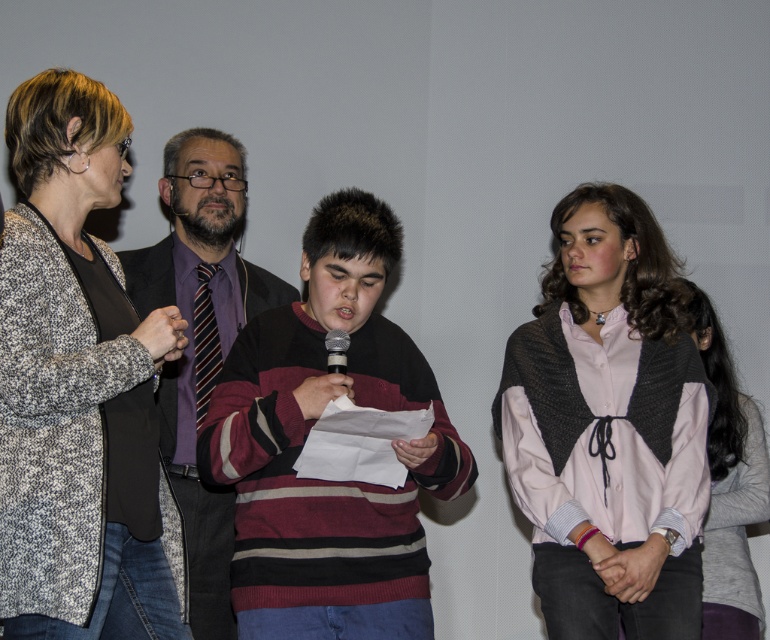
You are organizing a clothing donation drive and need to determine if the knitted gray shawl at right can fit into a box designed for items narrower than the striped sweater at center. Can the shawl fit?

The knitted gray shawl at right might be wider than the striped sweater at center, so it may not fit into the box designed for items narrower than the striped sweater at center.

Based on the scene description, which object is closer to the viewer between the speckled woolen cardigan at left and the striped sweater at center?

The speckled woolen cardigan at left is closer to the viewer because it is in front of the striped sweater at center.

You are standing at the center of the room and want to move towards the point labeled as point (601, 602). Which direction should you go relative to the point labeled as point (203, 266)?

You should move towards the front direction relative to the point labeled as point (203, 266) because point (601, 602) is in front of it.